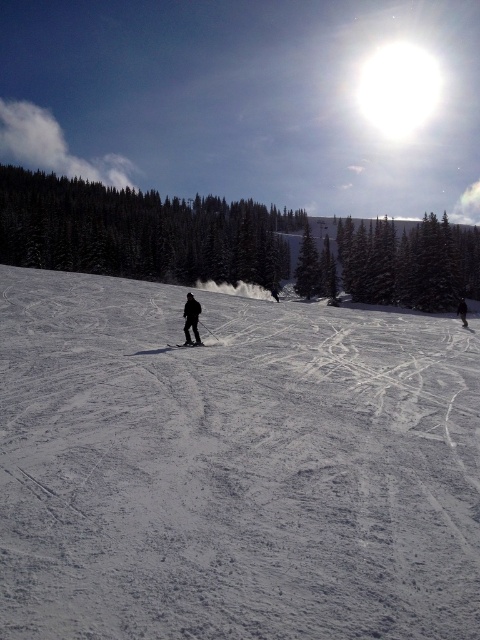
Question: Can you confirm if black matte skier at center is smaller than black matte ski at center?

Choices:
 (A) no
 (B) yes

Answer: (A)

Question: Which point is farther from the camera taking this photo?

Choices:
 (A) click(x=191, y=344)
 (B) click(x=121, y=196)
 (C) click(x=464, y=308)
 (D) click(x=467, y=321)

Answer: (B)

Question: Where is white powdery snow at center located in relation to black snowsuit at center in the image?

Choices:
 (A) below
 (B) above

Answer: (A)

Question: Which object is positioned farthest from the white matte ski at center?

Choices:
 (A) white powdery snow at center
 (B) black matte ski at center
 (C) black matte skier at center
 (D) green textured pine tree at left

Answer: (D)

Question: Is white powdery snow at center positioned behind white matte ski at center?

Choices:
 (A) no
 (B) yes

Answer: (A)

Question: Considering the real-world distances, which object is farthest from the black matte ski at center?

Choices:
 (A) white powdery snow at center
 (B) white matte ski at center
 (C) black matte skier at center
 (D) green textured pine tree at left

Answer: (D)